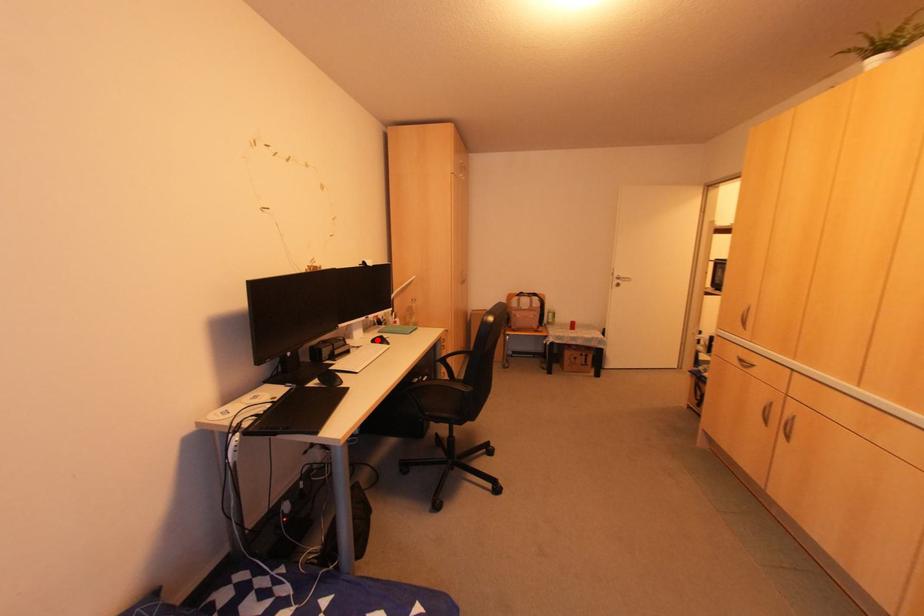
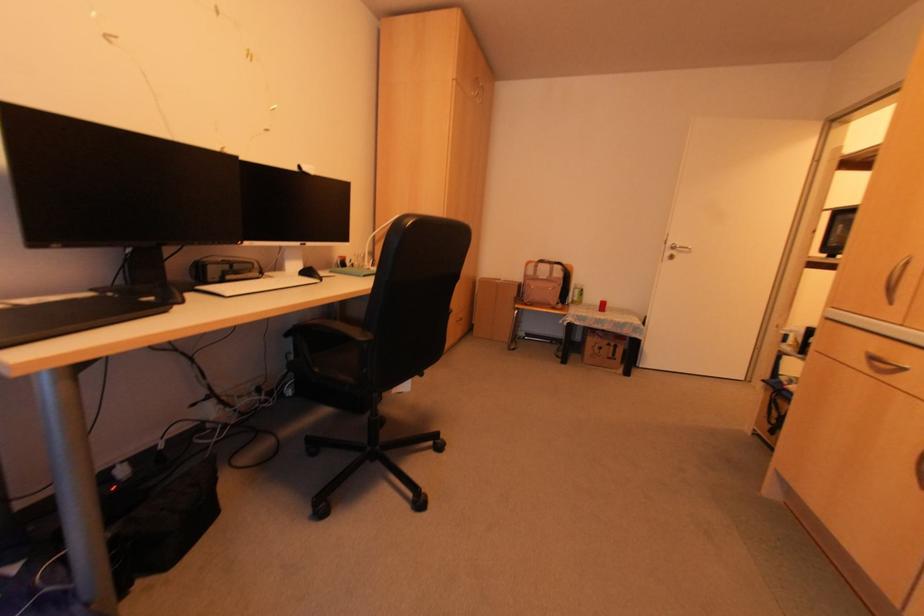
In the second image, find the point that corresponds to the highlighted location in the first image.

(305, 274)